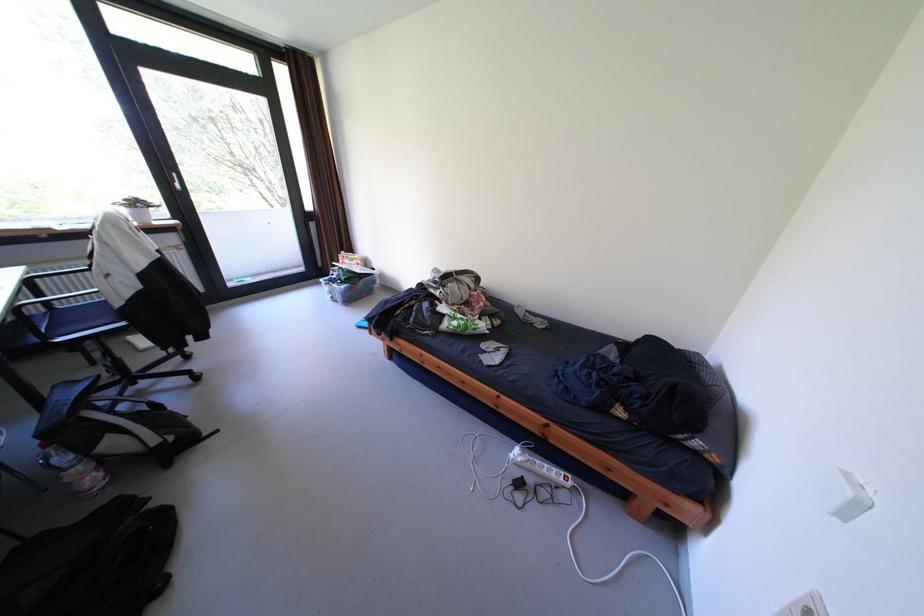
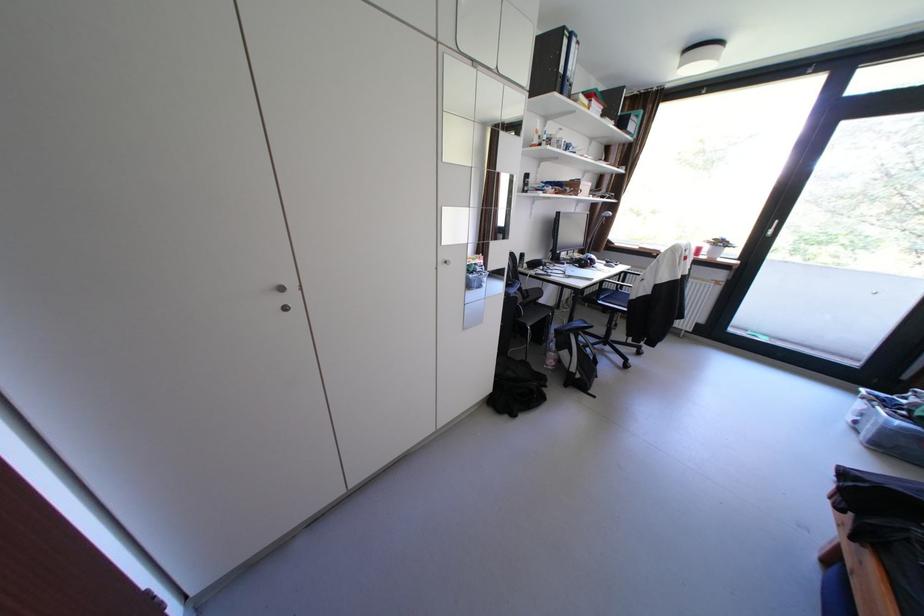
In the second image, find the point that corresponds to (x=87, y=516) in the first image.

(546, 368)